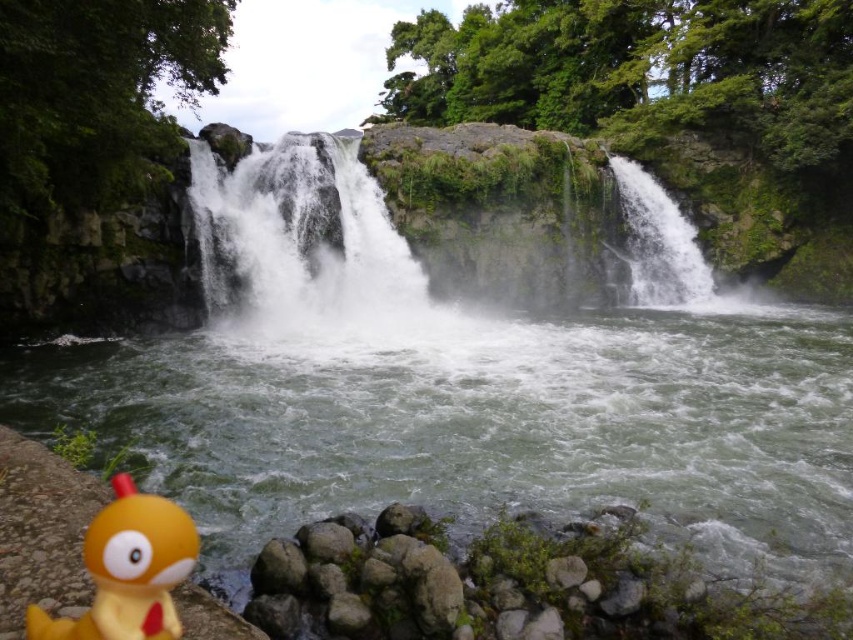
Question: From the image, what is the correct spatial relationship of white frothy water at center in relation to yellow rubber duck at lower left?

Choices:
 (A) below
 (B) above

Answer: (B)

Question: Does white frothy water at center come behind yellow rubber duck at lower left?

Choices:
 (A) yes
 (B) no

Answer: (A)

Question: Which object appears farthest from the camera in this image?

Choices:
 (A) white frothy water at center
 (B) yellow rubber duck at lower left
 (C) white frothy water at upper right

Answer: (C)

Question: Is white frothy water at center to the right of white frothy water at upper right from the viewer's perspective?

Choices:
 (A) yes
 (B) no

Answer: (B)

Question: Which is farther from the white frothy water at center?

Choices:
 (A) yellow rubber duck at lower left
 (B) white frothy water at upper right

Answer: (A)

Question: Which point is farther to the camera?

Choices:
 (A) (131, 612)
 (B) (412, 310)
 (C) (683, 284)

Answer: (C)